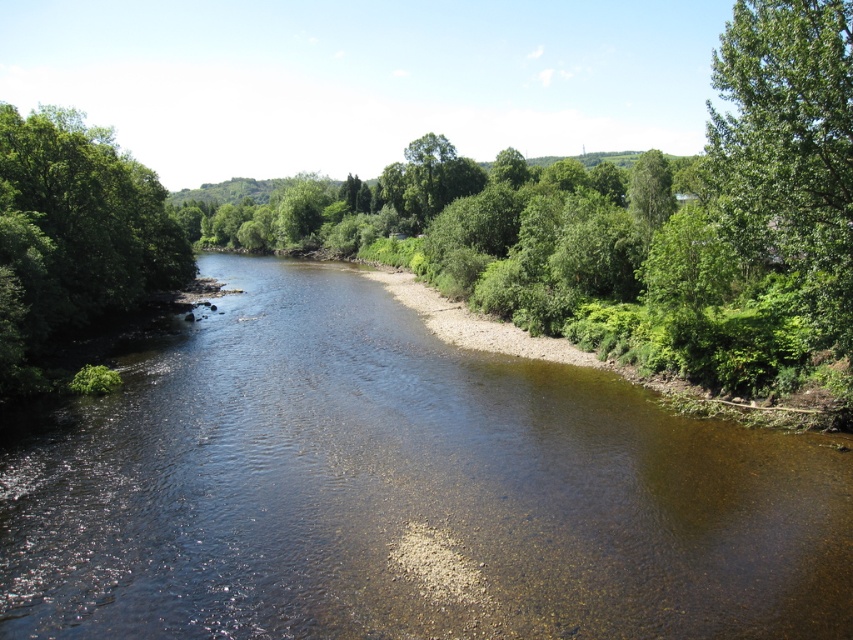
Who is higher up, clear water at center or green leafy tree at upper right?

green leafy tree at upper right

Where is `clear water at center`? The height and width of the screenshot is (640, 853). clear water at center is located at coordinates (405, 492).

How far apart are clear water at center and green leafy tree at left?

clear water at center and green leafy tree at left are 15.25 meters apart.

Is the position of clear water at center less distant than that of green leafy tree at left?

Yes, it is in front of green leafy tree at left.

Who is more distant from viewer, (817, 452) or (144, 205)?

The point (144, 205) is behind.

I want to click on clear water at center, so click(x=405, y=492).

Can you confirm if green leafy tree at upper right is shorter than green leafy tree at left?

Yes, green leafy tree at upper right is shorter than green leafy tree at left.

Measure the distance between green leafy tree at upper right and green leafy tree at left.

They are 139.42 feet apart.

The width and height of the screenshot is (853, 640). I want to click on green leafy tree at upper right, so click(788, 150).